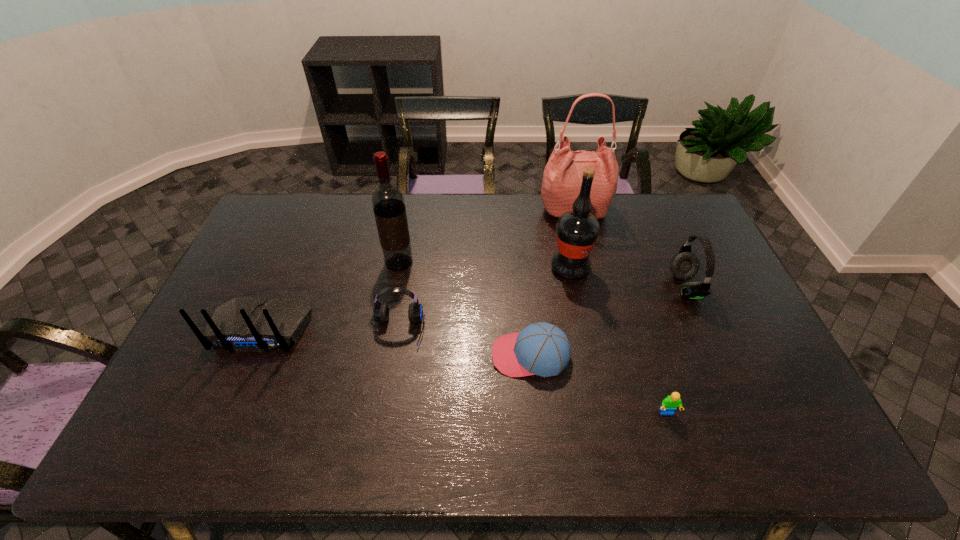
Identify the location of Lego. This screenshot has width=960, height=540. (670, 403).

Identify the location of free point located on the left of the farthest object. Image resolution: width=960 pixels, height=540 pixels. (474, 210).

Where is `free space located on the front of the left wine bottle`? The image size is (960, 540). free space located on the front of the left wine bottle is located at coordinates (378, 375).

Where is `free point located 0.180m on the back of the right wine bottle`? The image size is (960, 540). free point located 0.180m on the back of the right wine bottle is located at coordinates (561, 221).

Find the location of a particular element. This screenshot has height=540, width=960. vacant position located on the back of the leftmost object is located at coordinates pyautogui.click(x=228, y=407).

At what (x,y) coordinates should I click in order to perform the action: click on free space located on the ear cups of the taller headset. Please return your answer as a coordinate pair (x, y). Looking at the image, I should click on coord(639,287).

Identify the location of free space located 0.260m on the ear cups of the taller headset. (588, 287).

What are the coordinates of `vacant area situated 0.340m on the ear cups of the taller headset` in the screenshot? It's located at tap(563, 287).

Find the location of a particular element. Image resolution: width=960 pixels, height=540 pixels. free spot located 0.060m on the ear cushions of the third shortest object is located at coordinates (393, 368).

Where is `free space located 0.230m on the front-facing side of the baseball cap`? free space located 0.230m on the front-facing side of the baseball cap is located at coordinates (408, 355).